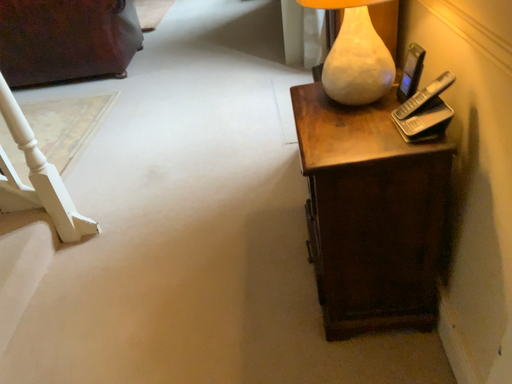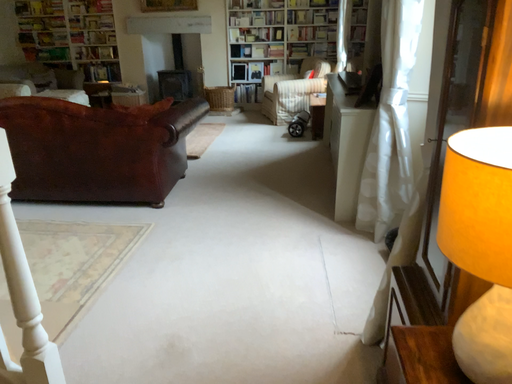
Question: How did the camera likely rotate when shooting the video?

Choices:
 (A) rotated downward
 (B) rotated upward

Answer: (B)